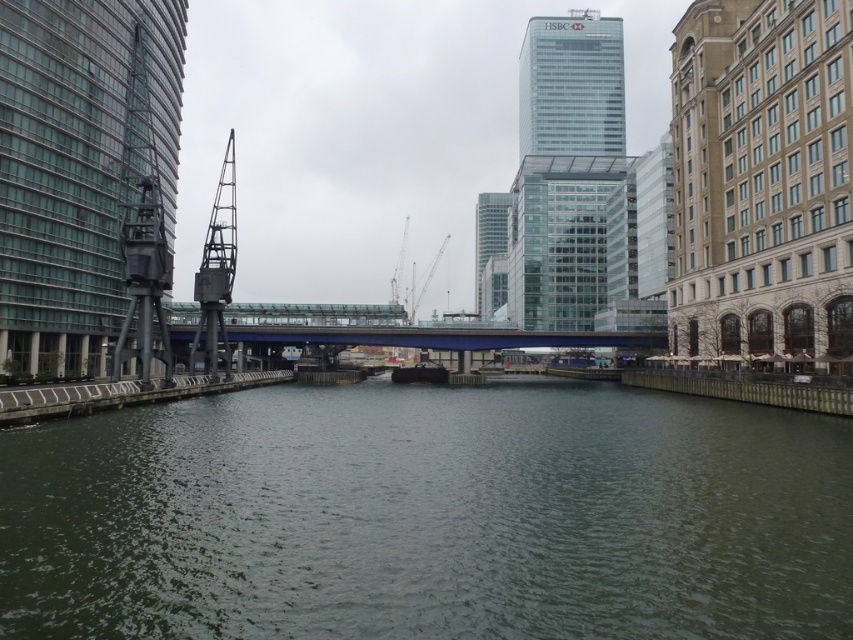
Who is lower down, blue metallic bridge at center or glassy reflective skyscraper at center?

blue metallic bridge at center is below.

Is point (292, 330) closer to camera compared to point (486, 280)?

That is True.

Where is `blue metallic bridge at center`? This screenshot has width=853, height=640. blue metallic bridge at center is located at coordinates (437, 337).

Can you confirm if glassy steel tower at left is positioned below blue metallic bridge at center?

No, glassy steel tower at left is not below blue metallic bridge at center.

Which is behind, point (22, 340) or point (450, 332)?

Positioned behind is point (450, 332).

Where is `glassy steel tower at left`? The width and height of the screenshot is (853, 640). glassy steel tower at left is located at coordinates (77, 168).

Where is `glassy steel tower at left`? This screenshot has height=640, width=853. glassy steel tower at left is located at coordinates (77, 168).

Does glassy steel tower at left appear on the left side of transparent glass skyscraper at upper center?

Indeed, glassy steel tower at left is positioned on the left side of transparent glass skyscraper at upper center.

Between glassy steel tower at left and transparent glass skyscraper at upper center, which one has less height?

glassy steel tower at left

Between point (45, 65) and point (595, 131), which one is positioned in front?

Point (45, 65) is more forward.

Image resolution: width=853 pixels, height=640 pixels. In order to click on glassy steel tower at left in this screenshot , I will do `click(77, 168)`.